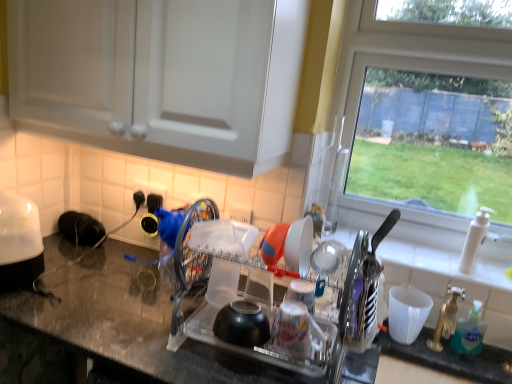
Find the location of a particular element. The image size is (512, 384). white glossy toaster at left is located at coordinates (19, 242).

What is the approximate width of white plastic cup at right, which is the 1th tableware in right-to-left order?

white plastic cup at right, which is the 1th tableware in right-to-left order, is 4.17 inches wide.

What is the approximate height of granite black countertop at center?

It is 80.41 centimeters.

This screenshot has height=384, width=512. Find the location of `white glossy cabinet at upper center`. white glossy cabinet at upper center is located at coordinates (161, 76).

What do you see at coordinates (469, 332) in the screenshot? I see `blue translucent soap dispenser at right` at bounding box center [469, 332].

What are the coordinates of `white plastic faucet at right` in the screenshot? It's located at (475, 240).

Is white glossy cabinet at upper center positioned with its back to white plastic cup at right, which is counted as the 2th tableware, starting from the left?

No, white plastic cup at right, which is counted as the 2th tableware, starting from the left, is not at the back of white glossy cabinet at upper center.

Who is more distant, white glossy cabinet at upper center or white plastic cup at right, which appears as the second tableware when viewed from the front?

white plastic cup at right, which appears as the second tableware when viewed from the front, is further from the camera.

Locate an element on the screen. tableware that is the 2nd object to the right of the white glossy cabinet at upper center, starting at the anchor is located at coordinates (407, 312).

Between white glossy cabinet at upper center and white plastic cup at right, the first tableware in the back-to-front sequence, which one has larger width?

white glossy cabinet at upper center is wider.

From the image's perspective, is orange plastic bowl at center, which appears as the 2th tableware when viewed from the back, on white plastic faucet at right?

Indeed, from the image's perspective, orange plastic bowl at center, which appears as the 2th tableware when viewed from the back, is shown above white plastic faucet at right.

Consider the image. Visually, is orange plastic bowl at center, the 1th tableware in the front-to-back sequence, positioned to the left or to the right of white plastic faucet at right?

Clearly, orange plastic bowl at center, the 1th tableware in the front-to-back sequence, is on the left of white plastic faucet at right in the image.

From a real-world perspective, is orange plastic bowl at center, placed as the 1th tableware when sorted from left to right, on top of white plastic faucet at right?

Yes, from a real-world perspective, orange plastic bowl at center, placed as the 1th tableware when sorted from left to right, is over white plastic faucet at right

Considering the relative sizes of white glossy toaster at left and white glossy cabinet at upper center in the image provided, is white glossy toaster at left taller than white glossy cabinet at upper center?

Incorrect, the height of white glossy toaster at left is not larger of that of white glossy cabinet at upper center.

Can you confirm if white glossy toaster at left is smaller than white glossy cabinet at upper center?

Yes.

Could you tell me if white glossy toaster at left is turned towards white glossy cabinet at upper center?

No, white glossy toaster at left does not turn towards white glossy cabinet at upper center.

The height and width of the screenshot is (384, 512). What are the coordinates of `cabinetry above the white glossy toaster at left (from the image's perspective)` in the screenshot? It's located at (161, 76).

Which is correct: white glossy toaster at left is inside blue translucent soap dispenser at right, or outside of it?

white glossy toaster at left is outside blue translucent soap dispenser at right.

Looking at this image, does white glossy toaster at left appear on the left side of blue translucent soap dispenser at right?

Indeed, white glossy toaster at left is positioned on the left side of blue translucent soap dispenser at right.

From a real-world perspective, does white glossy toaster at left stand above blue translucent soap dispenser at right?

Yes, from a real-world perspective, white glossy toaster at left is on top of blue translucent soap dispenser at right.

Considering the relative sizes of white glossy toaster at left and blue translucent soap dispenser at right in the image provided, is white glossy toaster at left shorter than blue translucent soap dispenser at right?

In fact, white glossy toaster at left may be taller than blue translucent soap dispenser at right.

Identify the location of faucet beneath the orange plastic bowl at center, marked as the 1th tableware in a top-to-bottom arrangement (from a real-world perspective). (475, 240).

Considering the relative sizes of white plastic faucet at right and orange plastic bowl at center, acting as the 2th tableware starting from the right, in the image provided, is white plastic faucet at right wider than orange plastic bowl at center, acting as the 2th tableware starting from the right,?

No, white plastic faucet at right is not wider than orange plastic bowl at center, acting as the 2th tableware starting from the right.

Who is shorter, white plastic faucet at right or orange plastic bowl at center, which appears as the 2th tableware when viewed from the back?

orange plastic bowl at center, which appears as the 2th tableware when viewed from the back, is shorter.

In the scene shown: From the image's perspective, which one is positioned higher, white plastic faucet at right or orange plastic bowl at center, placed as the 1th tableware when sorted from left to right?

orange plastic bowl at center, placed as the 1th tableware when sorted from left to right, from the image's perspective.

In the image, is white plastic faucet at right positioned in front of or behind white glossy cabinet at upper center?

Visually, white plastic faucet at right is located behind white glossy cabinet at upper center.

Identify the location of cabinetry positioned vertically above the white plastic faucet at right (from a real-world perspective). (161, 76).

From the image's perspective, which is below, white plastic faucet at right or white glossy cabinet at upper center?

white plastic faucet at right, from the image's perspective.

Measure the distance between white plastic faucet at right and white glossy cabinet at upper center.

white plastic faucet at right is 3.41 feet away from white glossy cabinet at upper center.

In the scene shown: Is white plastic cup at right, the first tableware from the bottom, not near blue translucent soap dispenser at right?

No, white plastic cup at right, the first tableware from the bottom, is in close proximity to blue translucent soap dispenser at right.

Looking at this image, does white plastic cup at right, which is the 1th tableware in right-to-left order, have a lesser height compared to blue translucent soap dispenser at right?

Yes.

Which is less distant, (396, 327) or (480, 347)?

Point (396, 327) is farther from the camera than point (480, 347).

Where is `soap dispenser in front of the white plastic cup at right, which is counted as the 2th tableware, starting from the left`? soap dispenser in front of the white plastic cup at right, which is counted as the 2th tableware, starting from the left is located at coordinates (469, 332).

Identify the location of cabinetry in front of the white plastic cup at right, which is counted as the 2th tableware, starting from the left. (161, 76).

At what (x,y) coordinates should I click in order to perform the action: click on tableware that is the 2nd one when counting leftward from the white plastic faucet at right. Please return your answer as a coordinate pair (x, y). This screenshot has height=384, width=512. Looking at the image, I should click on (273, 243).

Considering their positions, is transparent plastic dish rack at center positioned closer to orange plastic bowl at center, marked as the 1th tableware in a top-to-bottom arrangement, than transparent glass window at upper right?

transparent plastic dish rack at center is positioned closer to the anchor orange plastic bowl at center, marked as the 1th tableware in a top-to-bottom arrangement.

From the image, which object appears to be nearer to white glossy toaster at left, granite black countertop at center or blue translucent soap dispenser at right?

granite black countertop at center is positioned closer to the anchor white glossy toaster at left.

Which object lies nearer to the anchor point white plastic cup at right, which is counted as the 2th tableware, starting from the left, white glossy toaster at left or white glossy cabinet at upper center?

Based on the image, white glossy cabinet at upper center appears to be nearer to white plastic cup at right, which is counted as the 2th tableware, starting from the left.

Estimate the real-world distances between objects in this image. Which object is closer to white plastic faucet at right, transparent plastic dish rack at center or white glossy cabinet at upper center?

Based on the image, transparent plastic dish rack at center appears to be nearer to white plastic faucet at right.

From the image, which object appears to be nearer to granite black countertop at center, white plastic cup at right, the first tableware from the bottom, or orange plastic bowl at center, arranged as the second tableware when ordered from the bottom?

Among the two, orange plastic bowl at center, arranged as the second tableware when ordered from the bottom, is located nearer to granite black countertop at center.

From the image, which object appears to be farther from white glossy toaster at left, blue translucent soap dispenser at right or orange plastic bowl at center, which appears as the 2th tableware when viewed from the back?

The object further to white glossy toaster at left is blue translucent soap dispenser at right.

From the picture: Looking at the image, which one is located closer to transparent plastic dish rack at center, white glossy cabinet at upper center or orange plastic bowl at center, placed as the 1th tableware when sorted from left to right?

orange plastic bowl at center, placed as the 1th tableware when sorted from left to right.

Based on their spatial positions, is orange plastic bowl at center, placed as the 1th tableware when sorted from left to right, or white glossy toaster at left closer to white plastic cup at right, the first tableware from the bottom?

Based on the image, orange plastic bowl at center, placed as the 1th tableware when sorted from left to right, appears to be nearer to white plastic cup at right, the first tableware from the bottom.

You are a GUI agent. You are given a task and a screenshot of the screen. Output one action in this format:
    pyautogui.click(x=<x>, y=<y>)
    Task: Click on the soap dispenser located between transparent plastic dish rack at center and white plastic faucet at right in the left-right direction
    This screenshot has height=384, width=512.
    Given the screenshot: What is the action you would take?
    pyautogui.click(x=469, y=332)

The height and width of the screenshot is (384, 512). Identify the location of soap dispenser located between granite black countertop at center and white plastic faucet at right in the left-right direction. (469, 332).

The width and height of the screenshot is (512, 384). I want to click on cabinetry situated between white glossy toaster at left and orange plastic bowl at center, marked as the 1th tableware in a top-to-bottom arrangement, from left to right, so click(x=161, y=76).

This screenshot has height=384, width=512. Identify the location of countertop between white glossy toaster at left and transparent glass window at upper right from left to right. (128, 325).